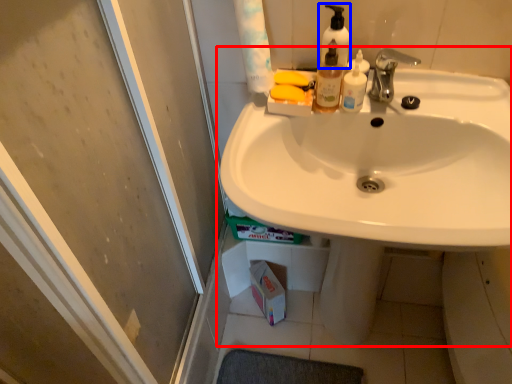
Question: Among these objects, which one is farthest to the camera, sink (highlighted by a red box) or soap dispenser (highlighted by a blue box)?

Choices:
 (A) sink
 (B) soap dispenser

Answer: (B)